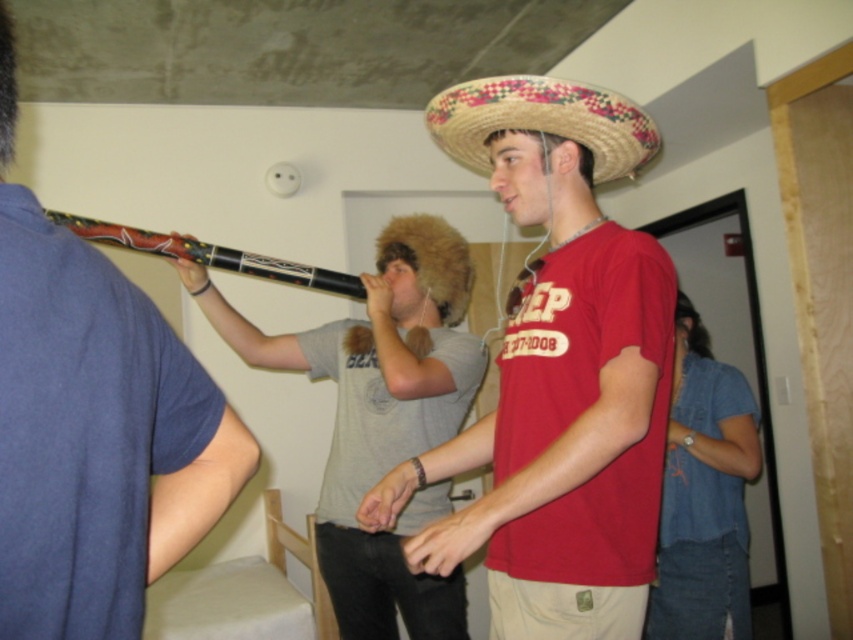
What object is located at the point with coordinates (558, 372)?

A: The point at (558, 372) indicates the matte straw sombrero at center.

You are at a party and need to find the matte black flute at upper left and the denim shirt at lower right. According to the scene, which object is located to the left of the other?

The matte black flute at upper left is positioned on the left side of denim shirt at lower right.

You are at a party and need to choose between placing a decorative item on a small table that can only hold one object. The options are the matte straw sombrero at center and the matte black flute at upper left. Which object would take up more space on the table?

The matte straw sombrero at center is bigger than the matte black flute at upper left, so it would take up more space on the table.